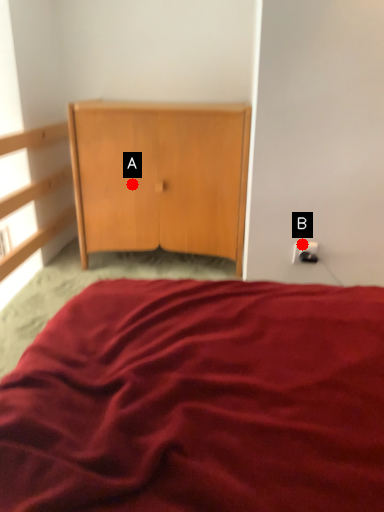
Question: Two points are circled on the image, labeled by A and B beside each circle. Which point is farther from the camera taking this photo?

Choices:
 (A) A is further
 (B) B is further

Answer: (A)